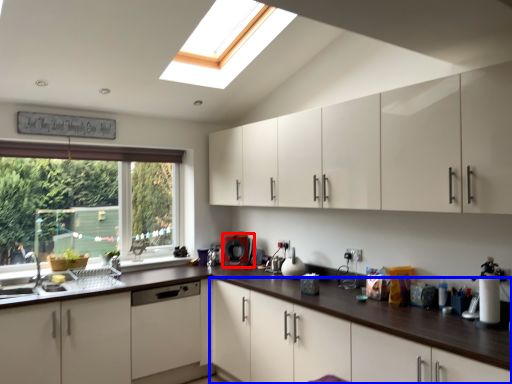
Question: Which point is closer to the camera, coffee machine (highlighted by a red box) or cabinetry (highlighted by a blue box)?

Choices:
 (A) coffee machine
 (B) cabinetry

Answer: (B)